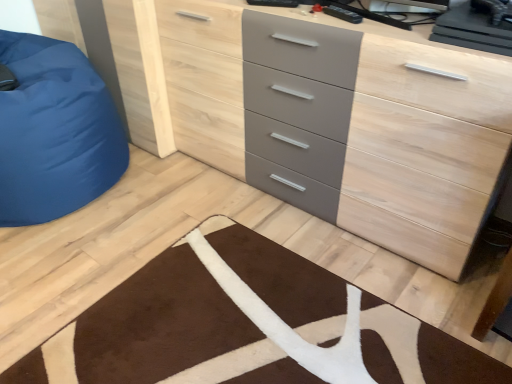
Locate an element on the screen. This screenshot has height=384, width=512. unoccupied space behind brown plush rug at lower center is located at coordinates (212, 210).